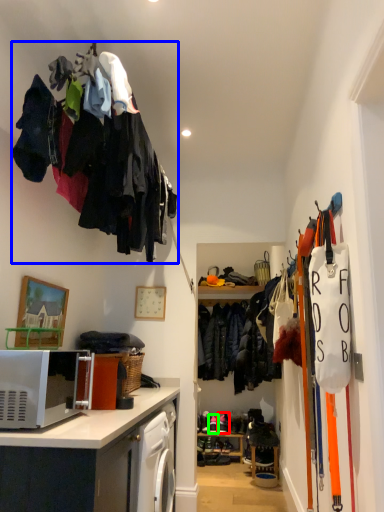
Question: Based on their relative distances, which object is farther from footwear (highlighted by a red box)? Choose from clothing (highlighted by a blue box) and footwear (highlighted by a green box).

Choices:
 (A) clothing
 (B) footwear

Answer: (A)